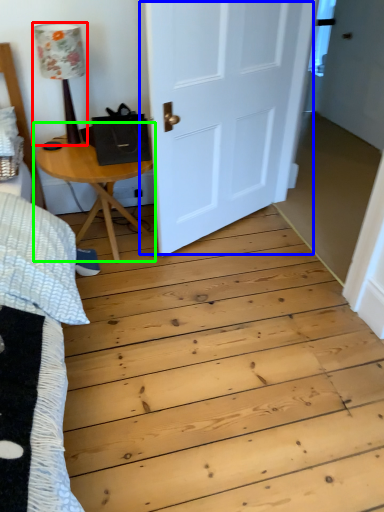
Question: Estimate the real-world distances between objects in this image. Which object is closer to lamp (highlighted by a red box), door (highlighted by a blue box) or table (highlighted by a green box)?

Choices:
 (A) door
 (B) table

Answer: (B)